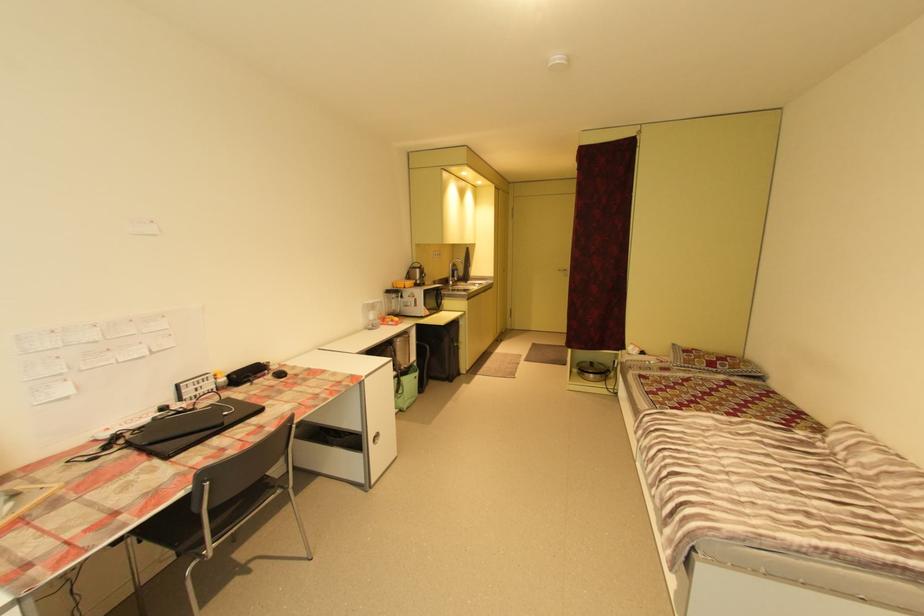
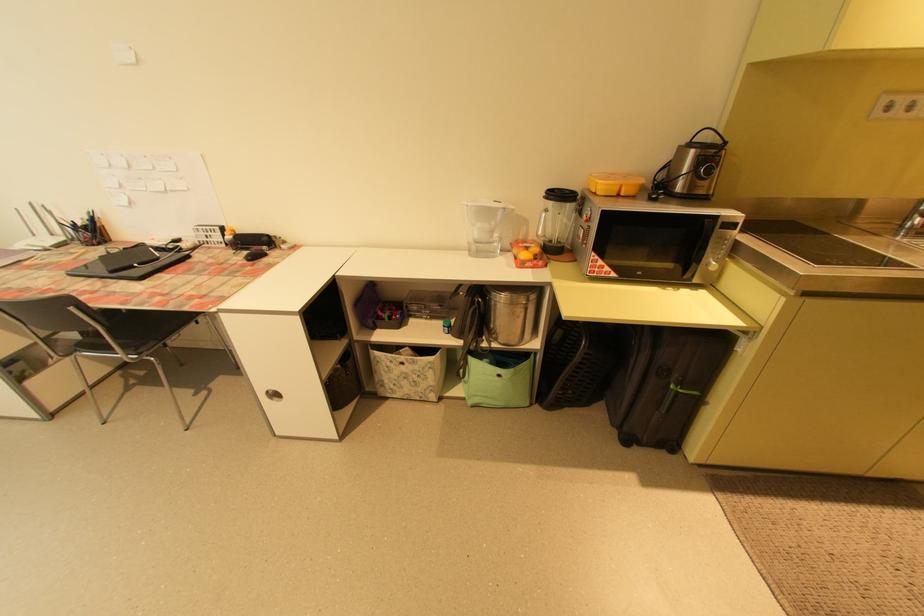
Locate, in the second image, the point that corresponds to [387,302] in the first image.

(511, 209)